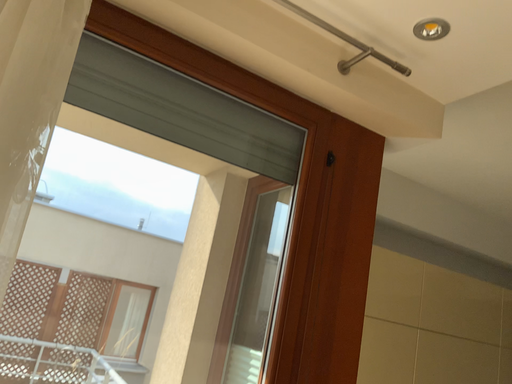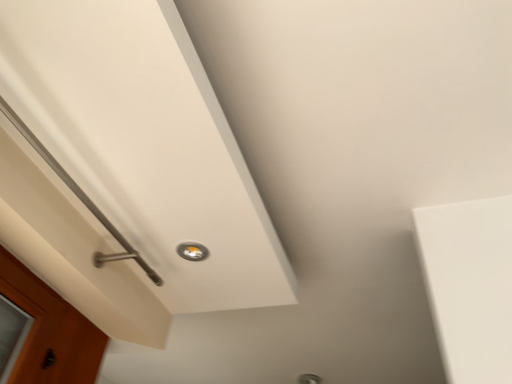
Question: Which way did the camera rotate in the video?

Choices:
 (A) rotated left
 (B) rotated right

Answer: (B)